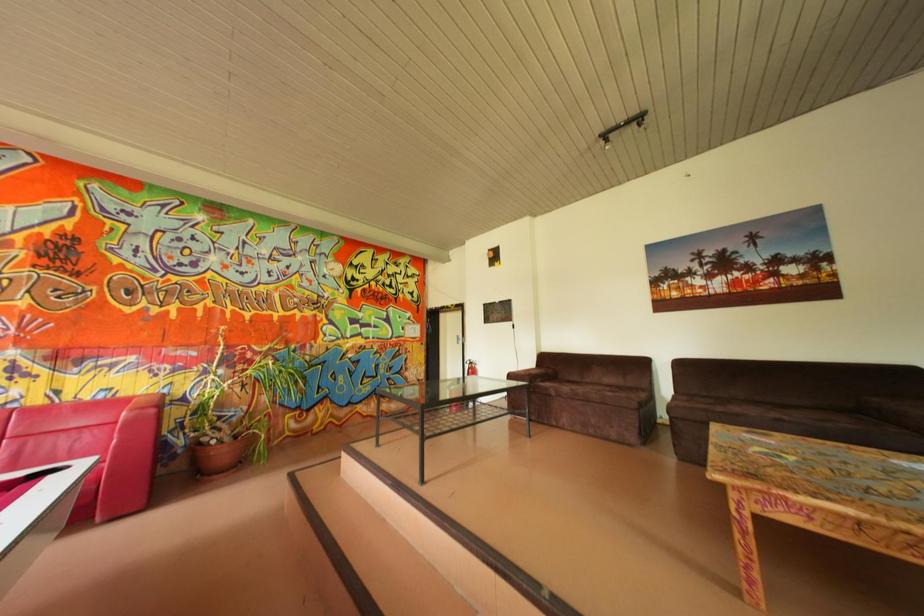
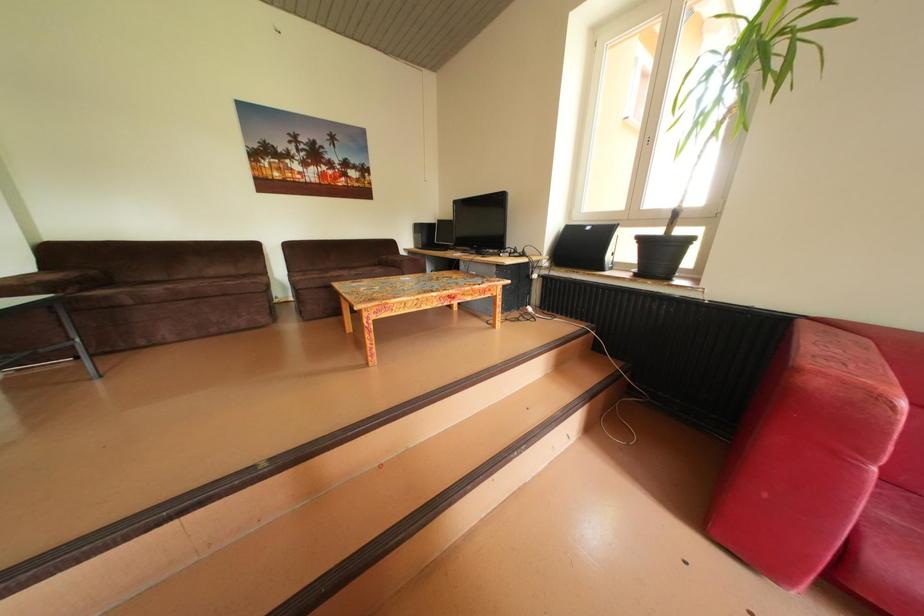
Based on the continuous images, in which direction is the camera rotating?

The camera's rotation is toward right-down.